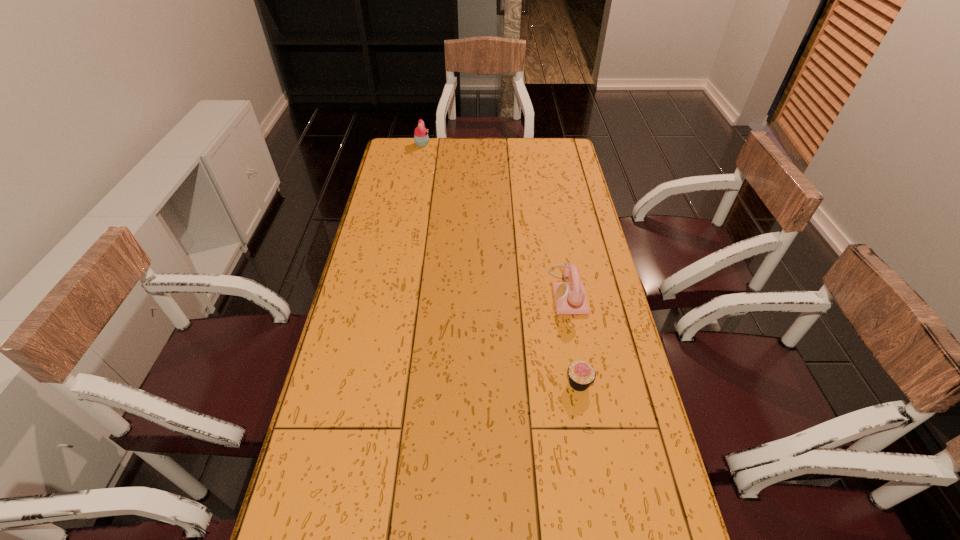
Find the location of a particular element. This screenshot has width=960, height=540. vacant point located between the telephone and the nearer cupcake is located at coordinates (573, 336).

At what (x,y) coordinates should I click in order to perform the action: click on unoccupied area between the second nearest object and the farthest object. Please return your answer as a coordinate pair (x, y). This screenshot has width=960, height=540. Looking at the image, I should click on (495, 218).

You are a GUI agent. You are given a task and a screenshot of the screen. Output one action in this format:
    pyautogui.click(x=<x>, y=<y>)
    Task: Click on the free spot between the telephone and the farther cupcake
    
    Given the screenshot: What is the action you would take?
    pyautogui.click(x=495, y=218)

Locate an element on the screen. the closest object to the nearest object is located at coordinates (570, 298).

Locate an element on the screen. This screenshot has width=960, height=540. object that can be found as the closest to the nearest object is located at coordinates (570, 298).

Image resolution: width=960 pixels, height=540 pixels. In order to click on cupcake that stands as the second closest to the telephone in this screenshot , I will do `click(421, 138)`.

This screenshot has height=540, width=960. I want to click on free point that satisfies the following two spatial constraints: 1. on the face of the farthest object; 2. on the right side of the nearest object, so 379,383.

This screenshot has height=540, width=960. I want to click on vacant space that satisfies the following two spatial constraints: 1. on the face of the left cupcake; 2. on the right side of the nearest object, so click(379, 383).